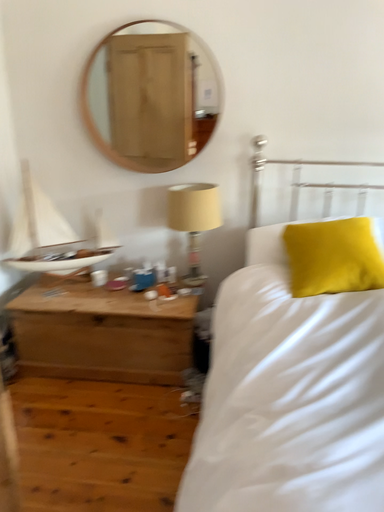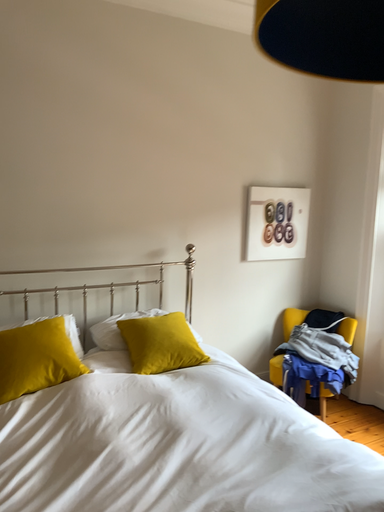
Question: How did the camera likely rotate when shooting the video?

Choices:
 (A) rotated right
 (B) rotated left

Answer: (A)